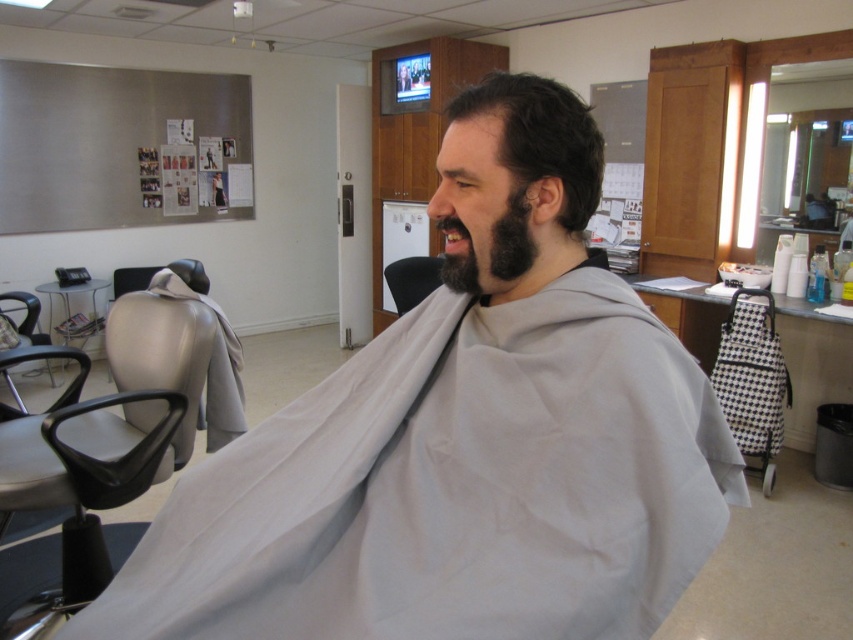
You are a customer entering the barbershop and see the matte gray chair at left and the black leather chair at center. Which chair is closer to the entrance?

The matte gray chair at left is closer to the entrance because it is in front of the black leather chair at center, indicating it is nearer to the entrance.

You are a customer entering the barbershop and see the matte gray chair at left. Where would you expect to find this chair in the barbershop?

The matte gray chair at left is located at point (102, 456) in the barbershop.

You are a customer entering the barbershop and want to sit down. There is a matte gray chair at left and a black leather chair at center. Which chair is closer to the entrance?

The matte gray chair at left is 1.84 meters from the black leather chair at center. However, the description does not specify the distance from the entrance, so we cannot determine which is closer based on the given information.